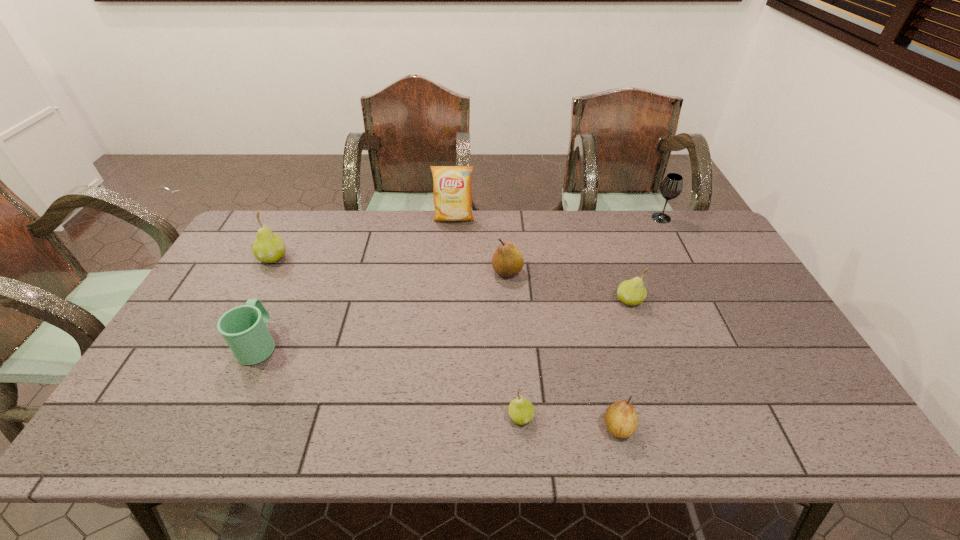
This screenshot has height=540, width=960. In order to click on object positioned at the right edge in this screenshot , I will do (x=671, y=187).

Identify the location of object that is at the far left corner. This screenshot has width=960, height=540. (268, 247).

Locate an element on the screen. The image size is (960, 540). object located at the far right corner is located at coordinates (671, 187).

Image resolution: width=960 pixels, height=540 pixels. What are the coordinates of `free location at the far edge of the desktop` in the screenshot? It's located at (676, 245).

The height and width of the screenshot is (540, 960). In the image, there is a desktop. Identify the location of vacant region at the near edge. (745, 434).

I want to click on vacant space at the left edge, so click(216, 325).

This screenshot has width=960, height=540. Find the location of `vacant area at the right edge`. vacant area at the right edge is located at coordinates (754, 325).

Identify the location of vacant space at the far left corner of the desktop. The height and width of the screenshot is (540, 960). (283, 224).

I want to click on vacant space at the far right corner of the desktop, so click(x=703, y=239).

Find the location of a particular element. This screenshot has height=540, width=960. vacant space at the near right corner of the desktop is located at coordinates (833, 424).